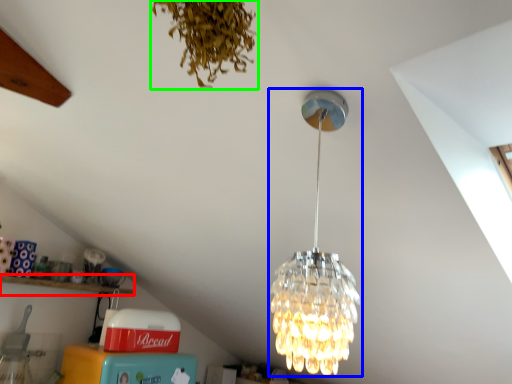
Question: Which object is the farthest from shelf (highlighted by a red box)? Choose among these: lamp (highlighted by a blue box) or plant (highlighted by a green box).

Choices:
 (A) lamp
 (B) plant

Answer: (B)